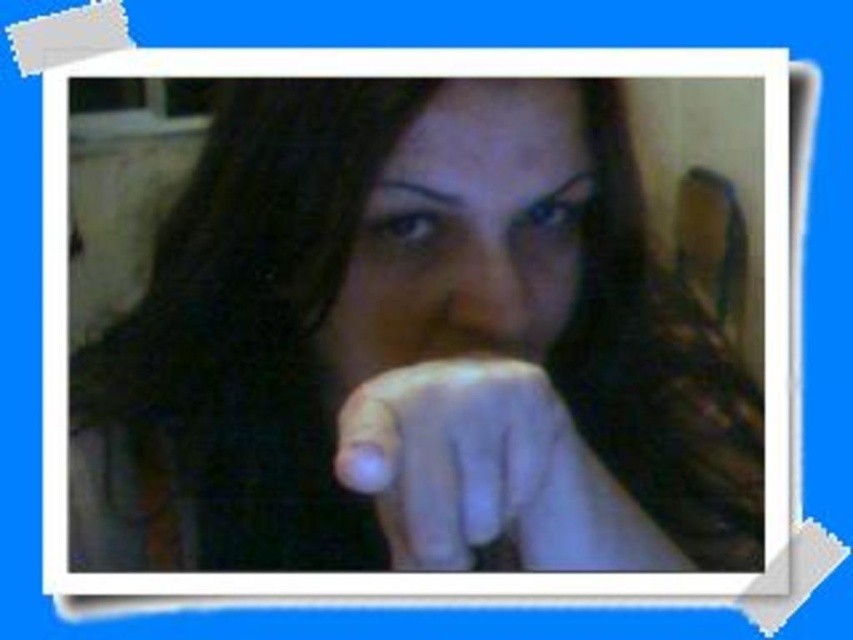
You are an artist trying to sketch the scene. You need to know the spatial relationship between the matte black hand at center and the smooth skin face at center. Which object is positioned to the right of the other?

The matte black hand at center is positioned on the right side of smooth skin face at center.

You are an artist trying to paint the scene where both matte black hand at center and white matte hand at center are present. Which hand should you paint first if you want to follow the layering order from top to bottom?

The matte black hand at center should be painted first because it is located above the white matte hand at center, following the layering order from top to bottom.

You are an artist trying to sketch this portrait. You notice two points in the image at coordinates point (462, 326) and point (457, 397). Which of these points is closer to the viewer?

Point (462, 326) is further to the viewer than point (457, 397), so the point closer to the viewer is point (457, 397).